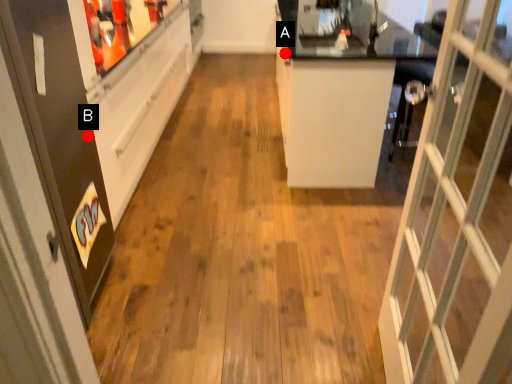
Question: Two points are circled on the image, labeled by A and B beside each circle. Which point is closer to the camera?

Choices:
 (A) A is closer
 (B) B is closer

Answer: (B)